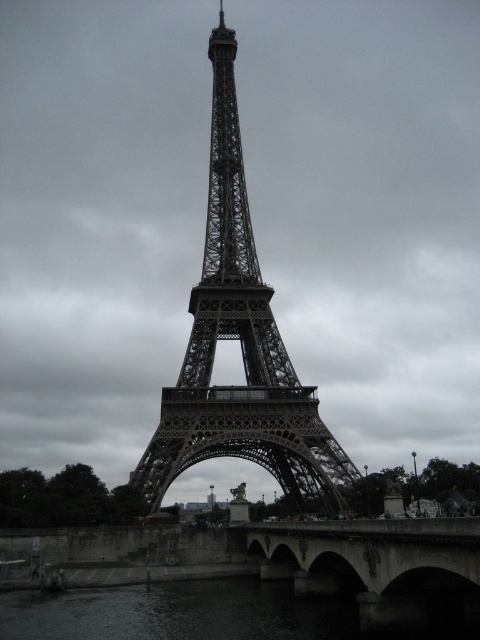
Is dark water at lower center positioned in front of concrete bridge at lower center?

No, dark water at lower center is behind concrete bridge at lower center.

Is dark water at lower center wider than concrete bridge at lower center?

Yes, dark water at lower center is wider than concrete bridge at lower center.

Does point (243, 621) come behind point (385, 584)?

That is True.

Where is `dark water at lower center`? dark water at lower center is located at coordinates (203, 612).

Is metallic lattice tower at center above dark water at lower center?

Yes.

Which is behind, point (308, 502) or point (23, 612)?

The point (308, 502) is more distant.

Is point (166, 456) in front of point (396, 634)?

Yes.

You are a GUI agent. You are given a task and a screenshot of the screen. Output one action in this format:
    pyautogui.click(x=<x>, y=<y>)
    Task: Click on the metallic lattice tower at center
    
    Given the screenshot: What is the action you would take?
    pyautogui.click(x=240, y=348)

Can you confirm if metallic lattice tower at center is positioned to the right of concrete bridge at lower center?

No, metallic lattice tower at center is not to the right of concrete bridge at lower center.

Is metallic lattice tower at center positioned at the back of concrete bridge at lower center?

Yes, it is.

What do you see at coordinates (240, 348) in the screenshot? The height and width of the screenshot is (640, 480). I see `metallic lattice tower at center` at bounding box center [240, 348].

The height and width of the screenshot is (640, 480). I want to click on metallic lattice tower at center, so click(x=240, y=348).